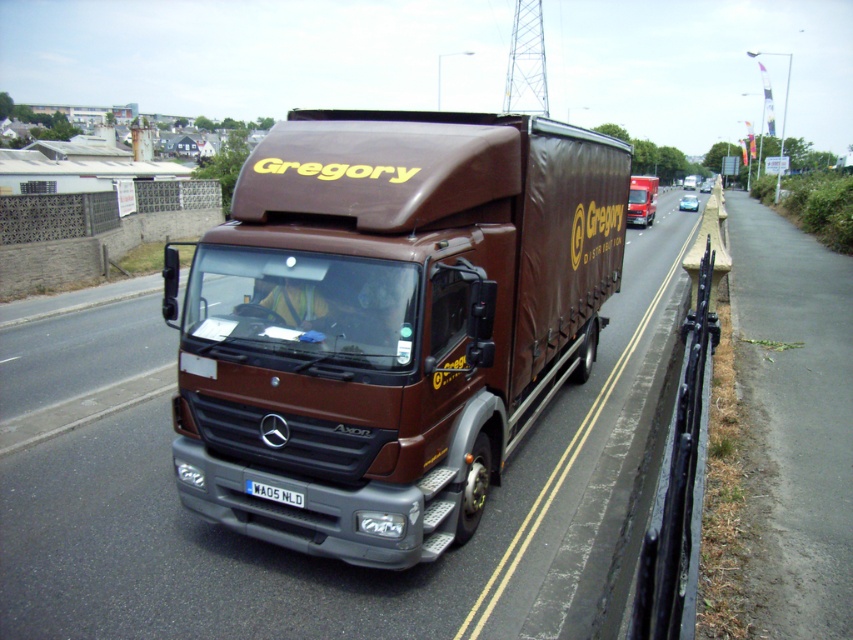
Is brown matte trailer truck at center bigger than brown matte truck at center?

No.

Between point (345, 164) and point (656, 195), which one is positioned behind?

The point (656, 195) is behind.

The image size is (853, 640). I want to click on brown matte trailer truck at center, so click(x=387, y=321).

Which is behind, point (515, 129) or point (264, 484)?

The point (515, 129) is more distant.

Does brown matte trailer truck at center have a smaller size compared to white plastic license plate at center?

Actually, brown matte trailer truck at center might be larger than white plastic license plate at center.

Locate an element on the screen. Image resolution: width=853 pixels, height=640 pixels. brown matte trailer truck at center is located at coordinates (387, 321).

Does brown matte truck at center appear on the right side of white plastic license plate at center?

Correct, you'll find brown matte truck at center to the right of white plastic license plate at center.

Image resolution: width=853 pixels, height=640 pixels. What do you see at coordinates (641, 198) in the screenshot?
I see `brown matte truck at center` at bounding box center [641, 198].

Is point (647, 196) positioned before point (297, 499)?

No, (647, 196) is behind (297, 499).

At what (x,y) coordinates should I click in order to perform the action: click on brown matte truck at center. Please return your answer as a coordinate pair (x, y). Looking at the image, I should click on (641, 198).